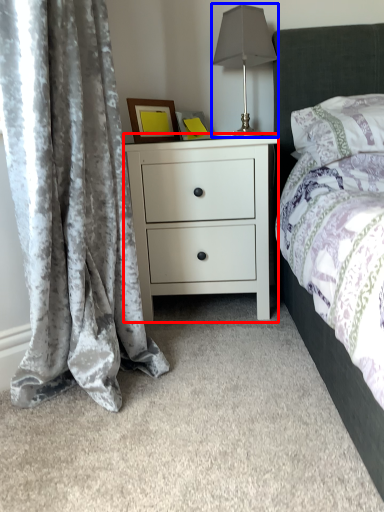
Question: Which point is further to the camera, nightstand (highlighted by a red box) or table lamp (highlighted by a blue box)?

Choices:
 (A) nightstand
 (B) table lamp

Answer: (B)